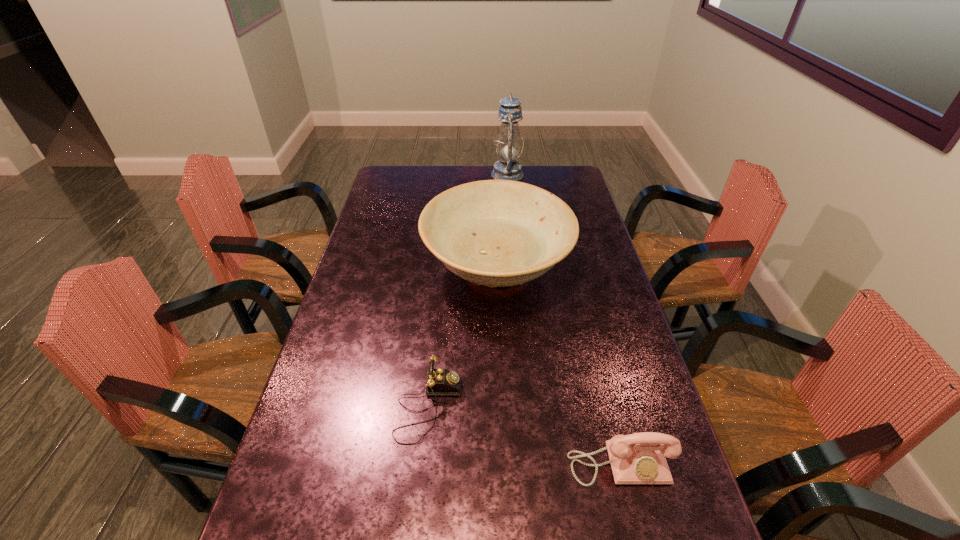
What are the coordinates of `vacant space located 0.090m on the front-facing side of the lantern` in the screenshot? It's located at (471, 174).

You are a GUI agent. You are given a task and a screenshot of the screen. Output one action in this format:
    pyautogui.click(x=<x>, y=<y>)
    Task: Click on the free location located on the front of the dish
    
    Given the screenshot: What is the action you would take?
    pyautogui.click(x=503, y=418)

The height and width of the screenshot is (540, 960). Identify the location of vacant space located on the dial of the third tallest object. (634, 522).

Locate an element on the screen. The image size is (960, 540). free space located 0.100m on the dial of the left telephone is located at coordinates (501, 407).

The width and height of the screenshot is (960, 540). Find the location of `object located at the far edge`. object located at the far edge is located at coordinates (508, 145).

Locate an element on the screen. This screenshot has width=960, height=540. dish that is at the right edge is located at coordinates (498, 233).

Find the location of a particular element. This screenshot has height=540, width=960. telephone that is at the right edge is located at coordinates (639, 458).

This screenshot has width=960, height=540. I want to click on free space at the far edge, so click(436, 178).

The image size is (960, 540). In the image, there is a desktop. Identify the location of vacant area at the left edge. (283, 455).

This screenshot has width=960, height=540. I want to click on free spot at the right edge of the desktop, so click(596, 244).